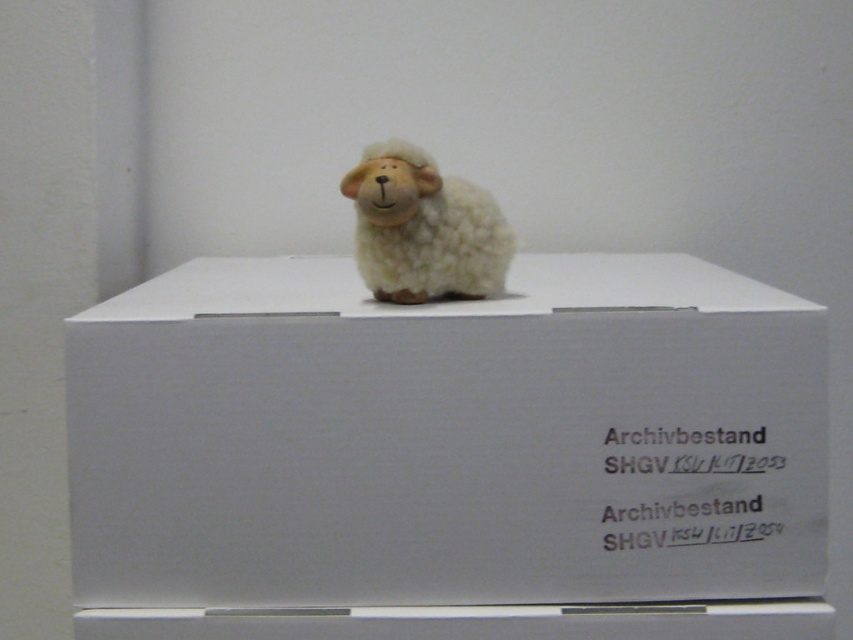
Question: Which object is closer to the camera taking this photo?

Choices:
 (A) fluffy white sheep at center
 (B) white matte cardboard box at center

Answer: (B)

Question: Is white matte cardboard box at center bigger than fluffy white sheep at center?

Choices:
 (A) no
 (B) yes

Answer: (B)

Question: Observing the image, what is the correct spatial positioning of white matte cardboard box at center in reference to fluffy white sheep at center?

Choices:
 (A) left
 (B) right

Answer: (B)

Question: Which point is closer to the camera taking this photo?

Choices:
 (A) (491, 234)
 (B) (294, 282)

Answer: (A)

Question: Does white matte cardboard box at center appear under fluffy white sheep at center?

Choices:
 (A) no
 (B) yes

Answer: (B)